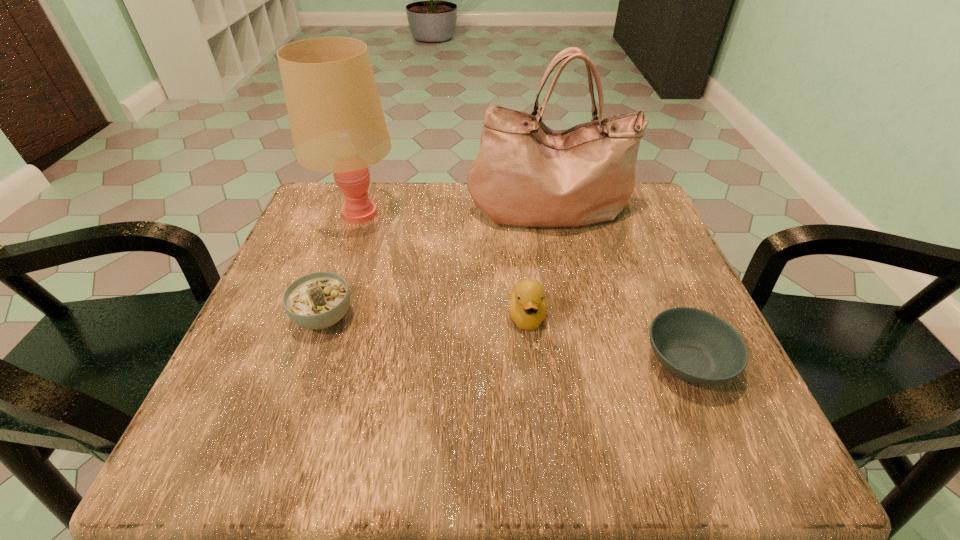
The height and width of the screenshot is (540, 960). Find the location of `vacant area between the shortest object and the third tallest object`. vacant area between the shortest object and the third tallest object is located at coordinates (607, 339).

Where is `free space between the duckling and the handbag`? This screenshot has width=960, height=540. free space between the duckling and the handbag is located at coordinates (539, 263).

The height and width of the screenshot is (540, 960). I want to click on vacant area that lies between the third tallest object and the handbag, so click(x=539, y=263).

Identify the location of free space between the third shortest object and the lampshade. This screenshot has width=960, height=540. (443, 265).

The image size is (960, 540). I want to click on empty location between the lampshade and the duckling, so click(443, 265).

What are the coordinates of `empty space between the lampshade and the handbag` in the screenshot? It's located at (454, 212).

Point out which object is positioned as the fourth nearest to the lampshade. Please provide its 2D coordinates. Your answer should be formatted as a tuple, i.e. [(x, y)], where the tuple contains the x and y coordinates of a point satisfying the conditions above.

[(696, 346)]

Identify which object is the third nearest to the shortest object. Please provide its 2D coordinates. Your answer should be formatted as a tuple, i.e. [(x, y)], where the tuple contains the x and y coordinates of a point satisfying the conditions above.

[(318, 300)]